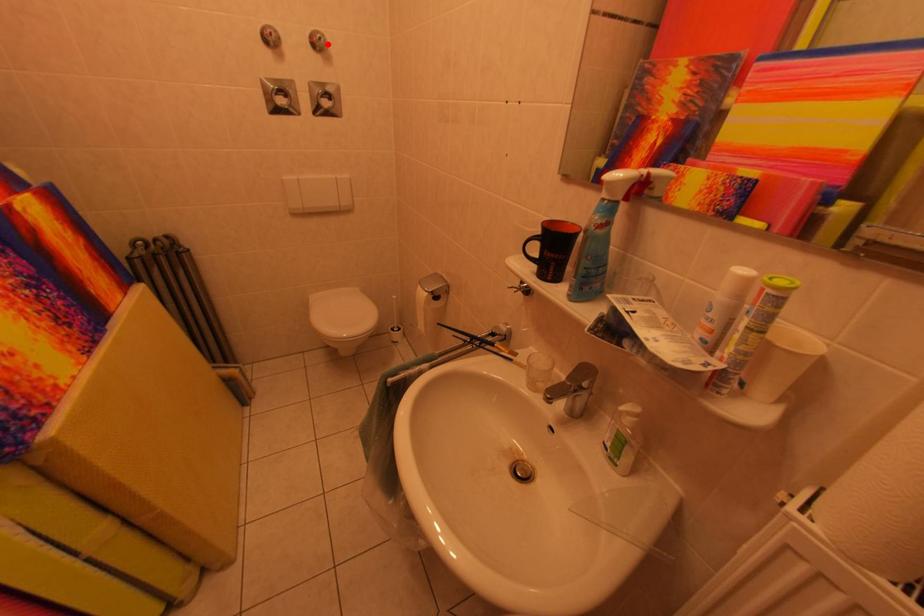
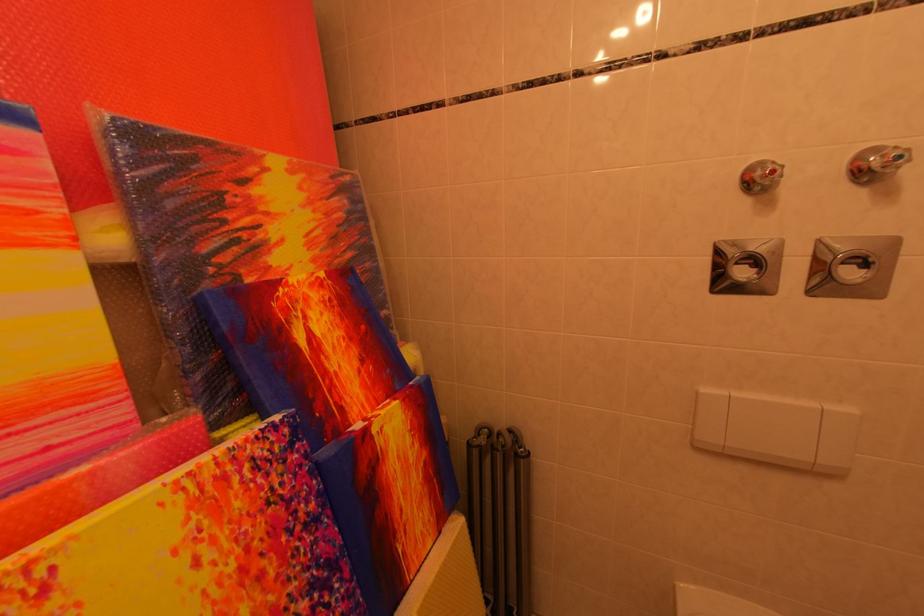
Where in the second image is the point corresponding to the highlighted location from the first image?

(907, 161)